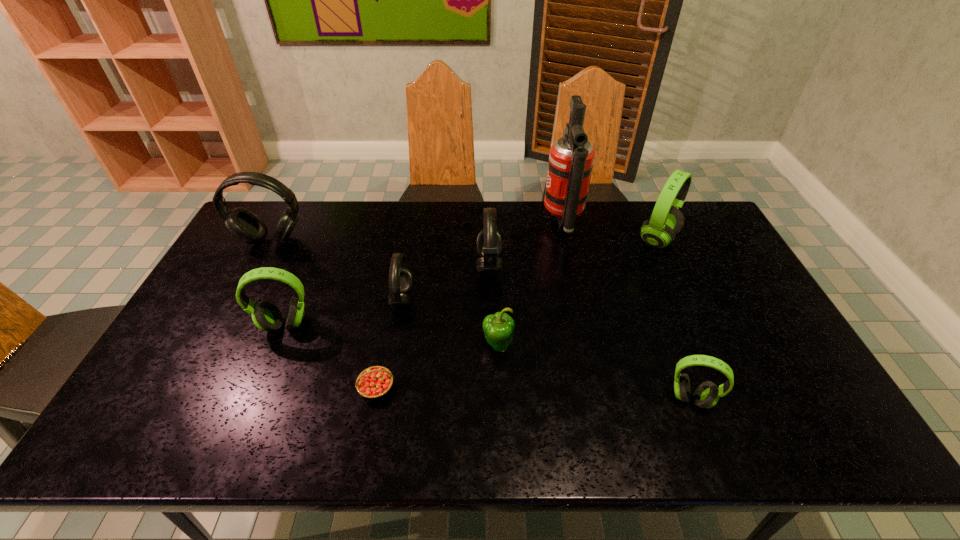
This screenshot has width=960, height=540. In order to click on empty location between the farthest green headset and the smallest gray headset in this screenshot , I will do `click(530, 269)`.

Where is `free area in between the leftmost green headset and the brown strawberry`? This screenshot has height=540, width=960. free area in between the leftmost green headset and the brown strawberry is located at coordinates (330, 356).

The image size is (960, 540). I want to click on free space between the shortest object and the second biggest gray headset, so click(x=433, y=327).

Where is `free area in between the fourth headset from right to left and the leftmost gray headset`? The image size is (960, 540). free area in between the fourth headset from right to left and the leftmost gray headset is located at coordinates (337, 269).

Image resolution: width=960 pixels, height=540 pixels. What are the coordinates of `unoccupied area between the smallest green headset and the leftmost green headset` in the screenshot? It's located at (488, 361).

At what (x,y) coordinates should I click in order to perform the action: click on vacant area that lies between the bell pepper and the nearest headset. Please return your answer as a coordinate pair (x, y). The height and width of the screenshot is (540, 960). Looking at the image, I should click on (594, 372).

Identify the location of free space between the nearest headset and the bell pepper. This screenshot has height=540, width=960. 594,372.

Locate an element on the screen. This screenshot has height=540, width=960. unoccupied area between the smallest green headset and the third object from right to left is located at coordinates (627, 309).

The height and width of the screenshot is (540, 960). In order to click on object that is the sixth closest to the third headset from left to right in this screenshot , I will do `click(571, 158)`.

Identify which object is the second closest to the fire extinguisher. Please provide its 2D coordinates. Your answer should be formatted as a tuple, i.e. [(x, y)], where the tuple contains the x and y coordinates of a point satisfying the conditions above.

[(666, 221)]